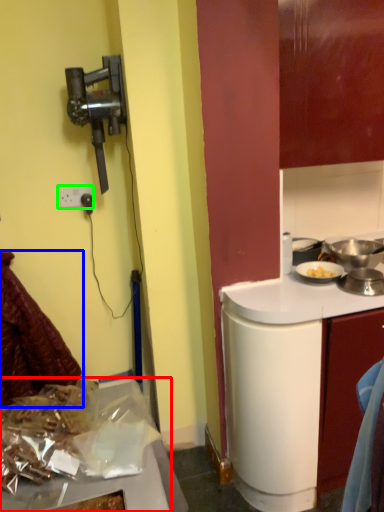
Question: Considering the real-world distances, which object is farthest from kitchen appliance (highlighted by a red box)? laundry (highlighted by a blue box) or power outlet (highlighted by a green box)?

Choices:
 (A) laundry
 (B) power outlet

Answer: (B)